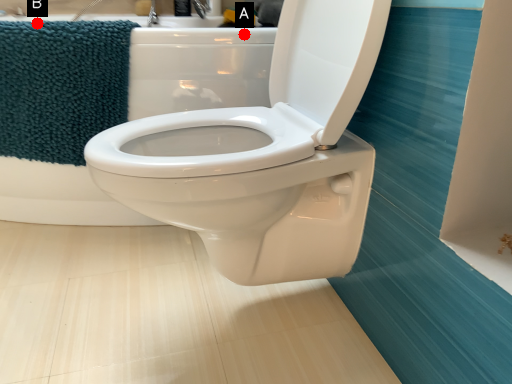
Question: Two points are circled on the image, labeled by A and B beside each circle. Which point is closer to the camera?

Choices:
 (A) A is closer
 (B) B is closer

Answer: (B)